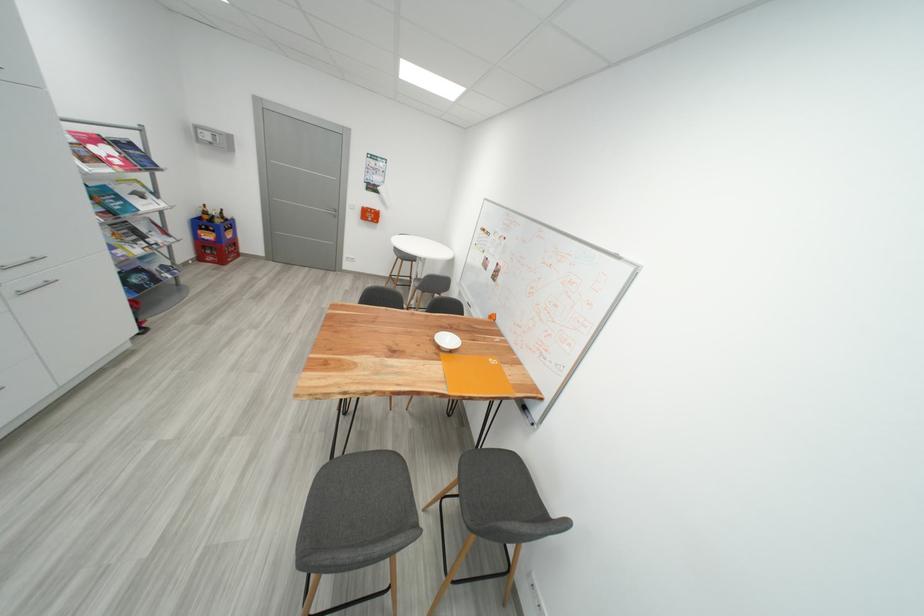
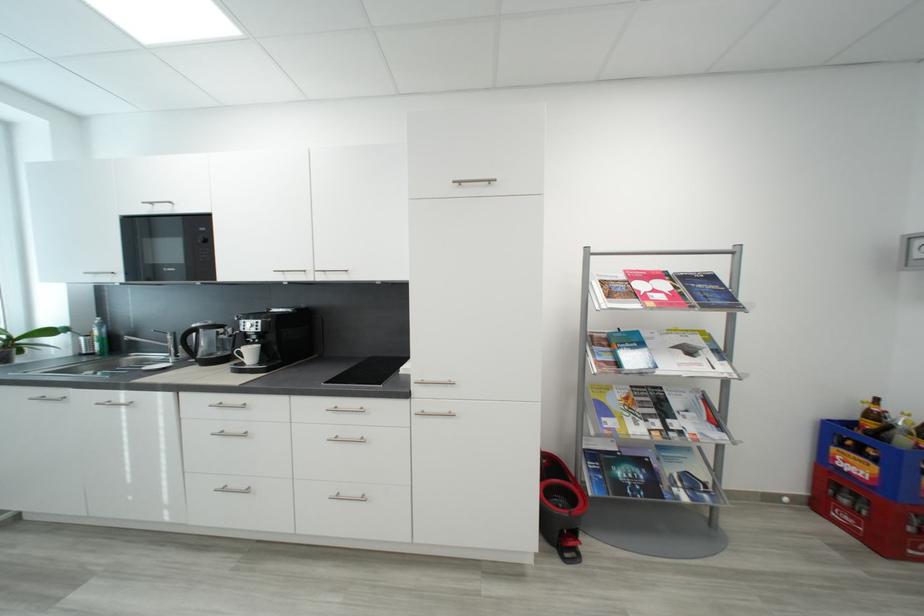
Find the pixel in the second image that matches (x=147, y=272) in the first image.

(650, 464)